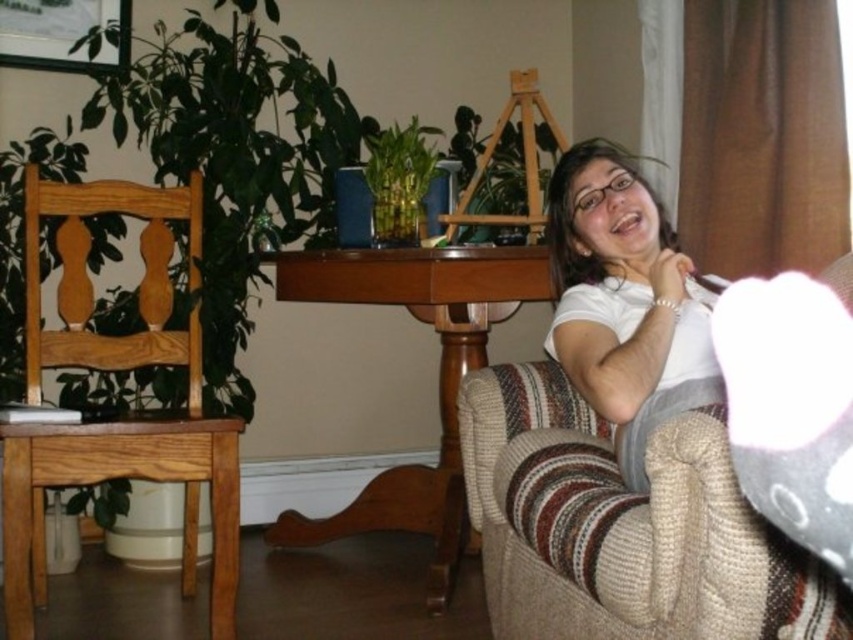
You are standing in the living room and want to place a small decorative item exactly at the point marked as point (534,582). If your arm reaches out 1.2 meters, can you comfortably place the item there without moving closer?

The distance of point (534,582) from viewer is 1.36 meters, so since your arm only reaches 1.2 meters, you would need to move closer to reach it.

You are arranging a small party in the living room and need to place a 1.2 meter long table between the knitted beige couch at lower right and the light brown wooden chair at left. Is there enough space between them to fit the table?

The knitted beige couch at lower right is positioned on the right side of the light brown wooden chair at left. Since the table is 1.2 meters long, it depends on the distance between them. However, the description does not provide specific measurements, so we cannot confirm if the space is sufficient.